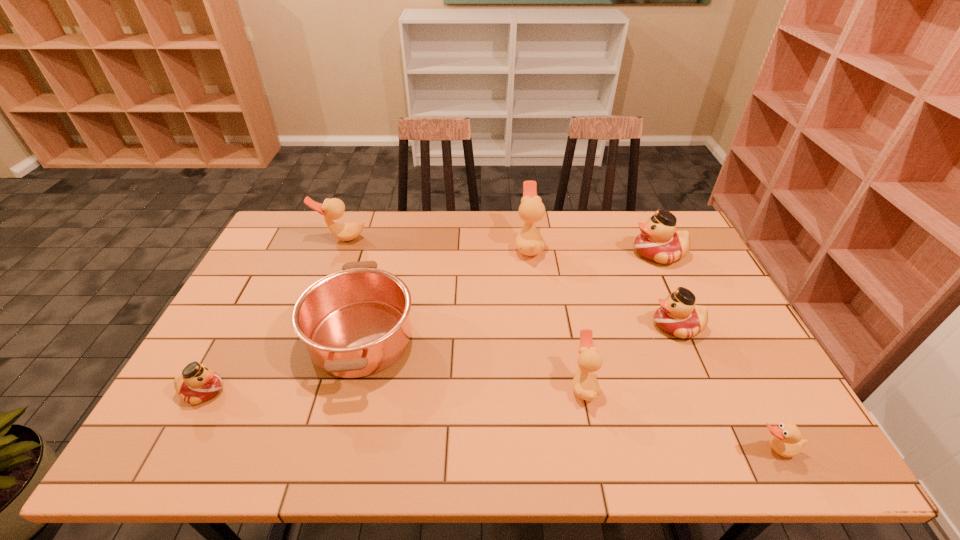
Find the location of a particular element. the fifth object from right to left is located at coordinates (529, 242).

Where is `the biggest tan duck`? Image resolution: width=960 pixels, height=540 pixels. the biggest tan duck is located at coordinates (529, 242).

Locate an element on the screen. The height and width of the screenshot is (540, 960). the farthest red duck is located at coordinates (658, 242).

Find the location of a particular element. The height and width of the screenshot is (540, 960). the leftmost tan duck is located at coordinates (332, 209).

At what (x,y) coordinates should I click in order to perform the action: click on the third smallest tan duck. Please return your answer as a coordinate pair (x, y). This screenshot has width=960, height=540. Looking at the image, I should click on click(332, 209).

I want to click on the second farthest red duck, so click(x=678, y=315).

Locate an element on the screen. the fourth farthest duck is located at coordinates (678, 315).

Locate an element on the screen. The width and height of the screenshot is (960, 540). the third farthest tan duck is located at coordinates (586, 386).

Locate an element on the screen. The width and height of the screenshot is (960, 540). the second tan duck from right to left is located at coordinates (586, 386).

Where is `saucepan`? This screenshot has height=540, width=960. saucepan is located at coordinates pyautogui.click(x=355, y=322).